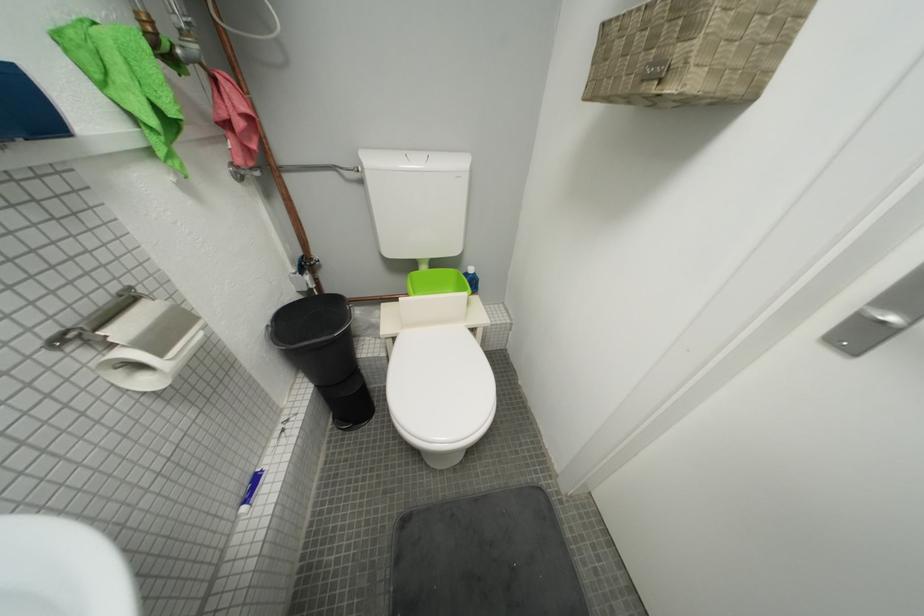
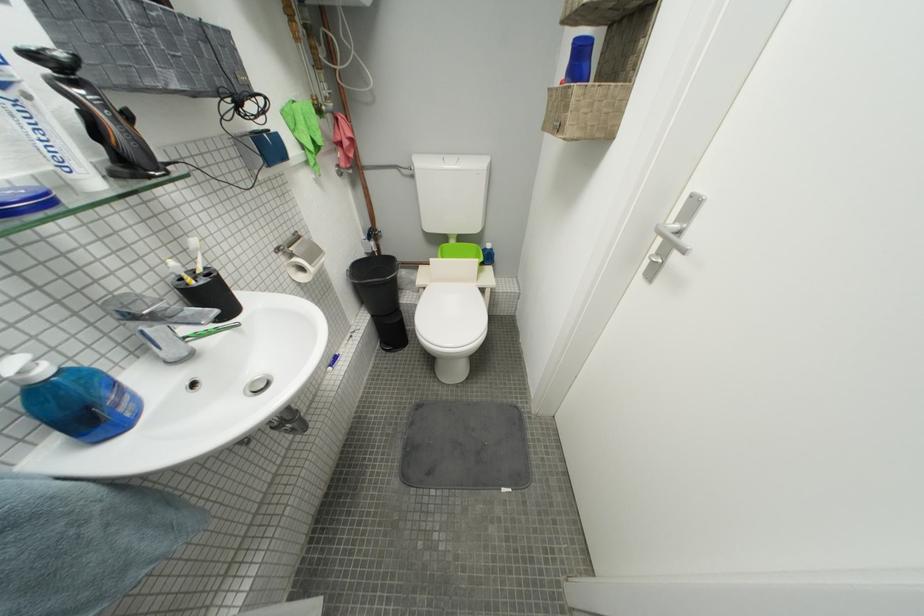
The point at (x=169, y=357) is marked in the first image. Where is the corresponding point in the second image?

(320, 265)